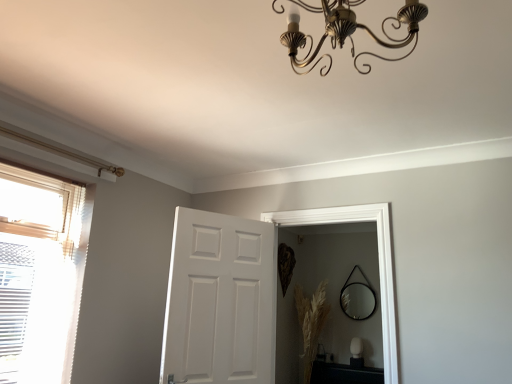
Question: Do you think black glossy table at lower right is within gold metallic chandelier at upper center, or outside of it?

Choices:
 (A) outside
 (B) inside

Answer: (A)

Question: In terms of width, does black glossy table at lower right look wider or thinner when compared to gold metallic chandelier at upper center?

Choices:
 (A) wide
 (B) thin

Answer: (A)

Question: Which of these objects is positioned farthest from the gold metallic chandelier at upper center?

Choices:
 (A) white matte door at center
 (B) dry grass at lower right
 (C) black glossy table at lower right
 (D) black glass mirror at center
 (E) translucent fabric window at left

Answer: (D)

Question: Which object is the farthest from the gold metallic chandelier at upper center?

Choices:
 (A) black glass mirror at center
 (B) translucent fabric window at left
 (C) dry grass at lower right
 (D) black glossy table at lower right
 (E) white matte door at center

Answer: (A)